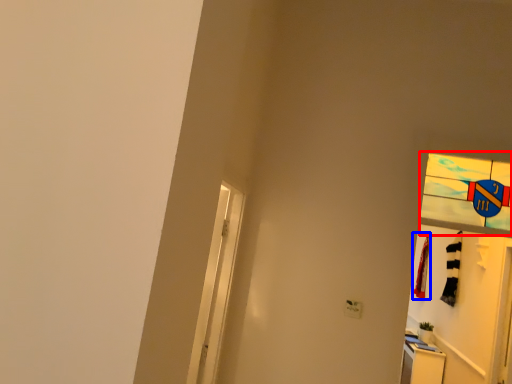
Question: Which of the following is the closest to the observer, glass window (highlighted by a red box) or laundry (highlighted by a blue box)?

Choices:
 (A) glass window
 (B) laundry

Answer: (A)